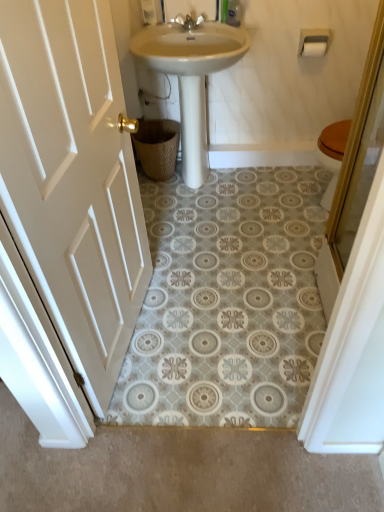
Question: Does clear plastic bottle at upper center have a greater height compared to white wood door at left?

Choices:
 (A) no
 (B) yes

Answer: (A)

Question: Does clear plastic bottle at upper center have a lesser height compared to white wood door at left?

Choices:
 (A) no
 (B) yes

Answer: (B)

Question: From a real-world perspective, is clear plastic bottle at upper center below white wood door at left?

Choices:
 (A) no
 (B) yes

Answer: (A)

Question: Does clear plastic bottle at upper center appear on the right side of white wood door at left?

Choices:
 (A) yes
 (B) no

Answer: (A)

Question: Is clear plastic bottle at upper center facing towards white wood door at left?

Choices:
 (A) yes
 (B) no

Answer: (B)

Question: Does clear plastic bottle at upper center come behind white wood door at left?

Choices:
 (A) yes
 (B) no

Answer: (A)

Question: Does white plastic toilet paper holder at upper right appear on the left side of white matte toilet paper at upper right?

Choices:
 (A) no
 (B) yes

Answer: (B)

Question: Would you say white matte toilet paper at upper right is part of white plastic toilet paper holder at upper right's contents?

Choices:
 (A) no
 (B) yes

Answer: (B)

Question: From the image's perspective, is white plastic toilet paper holder at upper right under white matte toilet paper at upper right?

Choices:
 (A) no
 (B) yes

Answer: (A)

Question: Are white plastic toilet paper holder at upper right and white matte toilet paper at upper right located far from each other?

Choices:
 (A) yes
 (B) no

Answer: (B)

Question: From the image's perspective, does white plastic toilet paper holder at upper right appear higher than white matte toilet paper at upper right?

Choices:
 (A) yes
 (B) no

Answer: (A)

Question: Does white plastic toilet paper holder at upper right turn towards white matte toilet paper at upper right?

Choices:
 (A) no
 (B) yes

Answer: (B)

Question: Does silver metallic faucet at upper center have a lesser width compared to white plastic toilet paper holder at upper right?

Choices:
 (A) no
 (B) yes

Answer: (A)